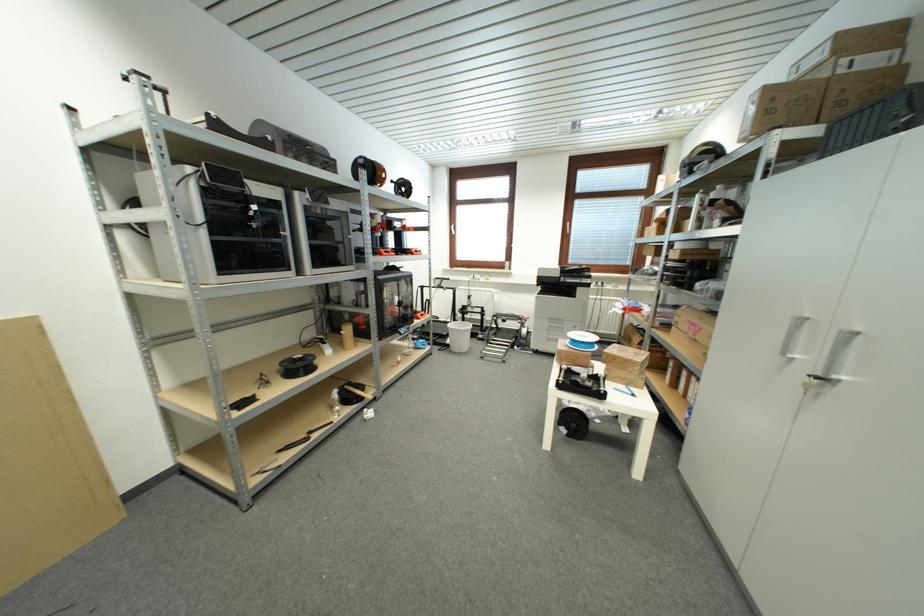
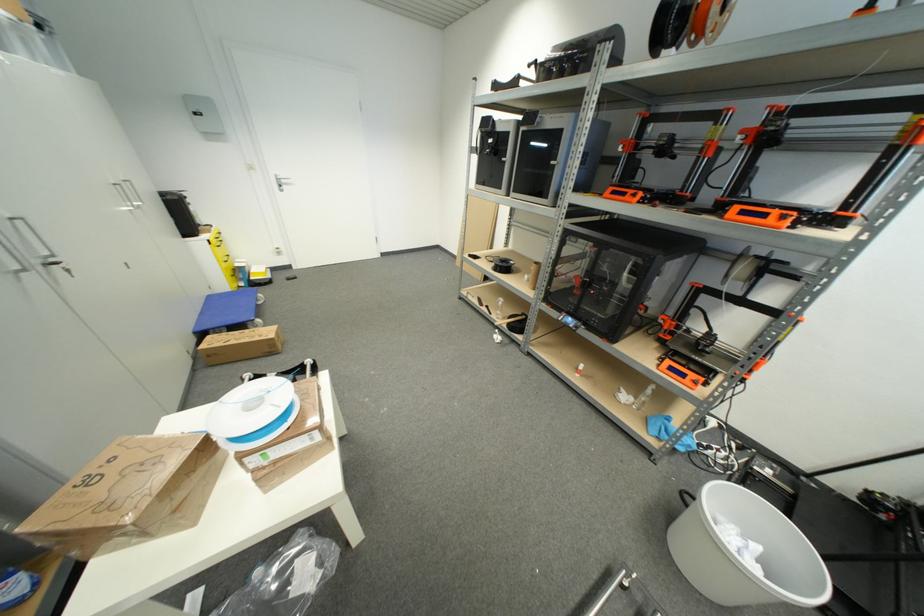
Where in the second image is the point corresponding to point (426, 318) from the first image?

(675, 371)